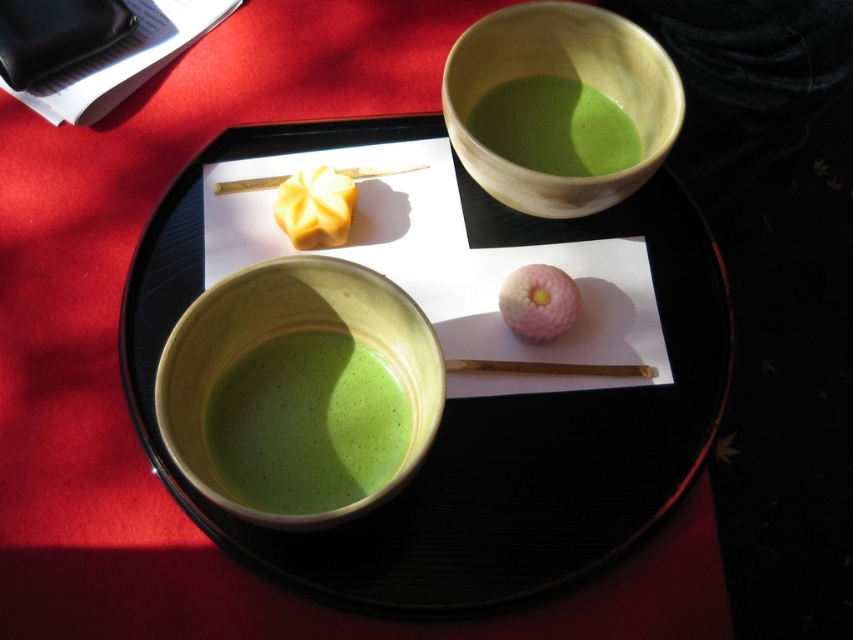
Between wooden chopstick at center and wooden chopstick at upper center, which one has more height?

Standing taller between the two is wooden chopstick at upper center.

Measure the distance from wooden chopstick at center to wooden chopstick at upper center.

wooden chopstick at center is 11.36 inches away from wooden chopstick at upper center.

Where is `wooden chopstick at center`? This screenshot has width=853, height=640. wooden chopstick at center is located at coordinates (547, 368).

You are a GUI agent. You are given a task and a screenshot of the screen. Output one action in this format:
    pyautogui.click(x=<x>, y=<y>)
    Task: Click on the wooden chopstick at center
    This screenshot has width=853, height=640.
    Given the screenshot: What is the action you would take?
    pyautogui.click(x=547, y=368)

Is yellow creamy pastry at upper left below pink fluffy donut at center?

Incorrect, yellow creamy pastry at upper left is not positioned below pink fluffy donut at center.

Between point (321, 236) and point (563, 317), which one is positioned in front?

Point (563, 317) is in front.

Is point (347, 186) positioned before point (526, 289)?

No, (347, 186) is further to viewer.

Identify the location of yellow creamy pastry at upper left. The width and height of the screenshot is (853, 640). (315, 208).

Between point (349, 339) and point (558, 321), which one is positioned in front?

Point (558, 321) is more forward.

Which of these two, green matte soup at center or pink fluffy donut at center, stands taller?

green matte soup at center

Is point (376, 445) closer to viewer compared to point (538, 314)?

Yes, it is.

At what (x,y) coordinates should I click in order to perform the action: click on green matte soup at center. Please return your answer as a coordinate pair (x, y). The height and width of the screenshot is (640, 853). Looking at the image, I should click on (306, 422).